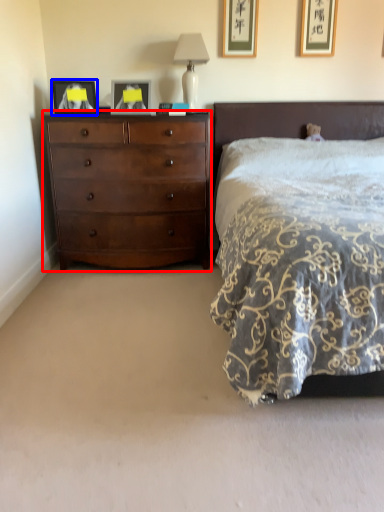
Question: Which point is closer to the camera, chest of drawers (highlighted by a red box) or picture frame (highlighted by a blue box)?

Choices:
 (A) chest of drawers
 (B) picture frame

Answer: (A)